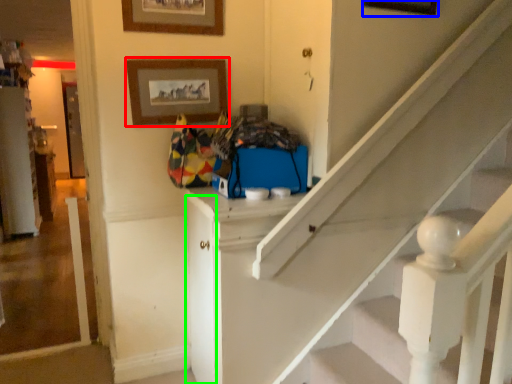
Question: Estimate the real-world distances between objects in this image. Which object is farther from picture frame (highlighted by a red box), picture frame (highlighted by a blue box) or door (highlighted by a green box)?

Choices:
 (A) picture frame
 (B) door

Answer: (A)